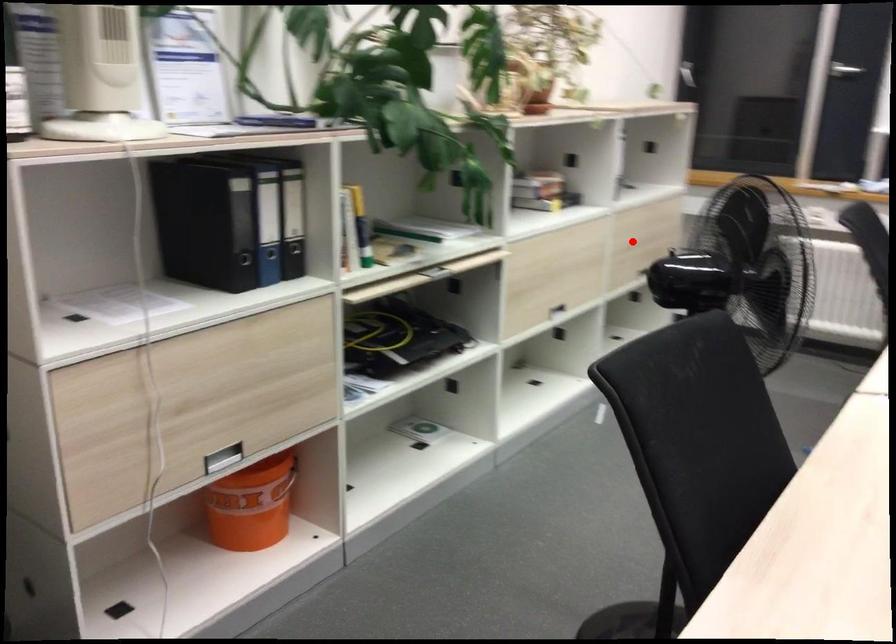
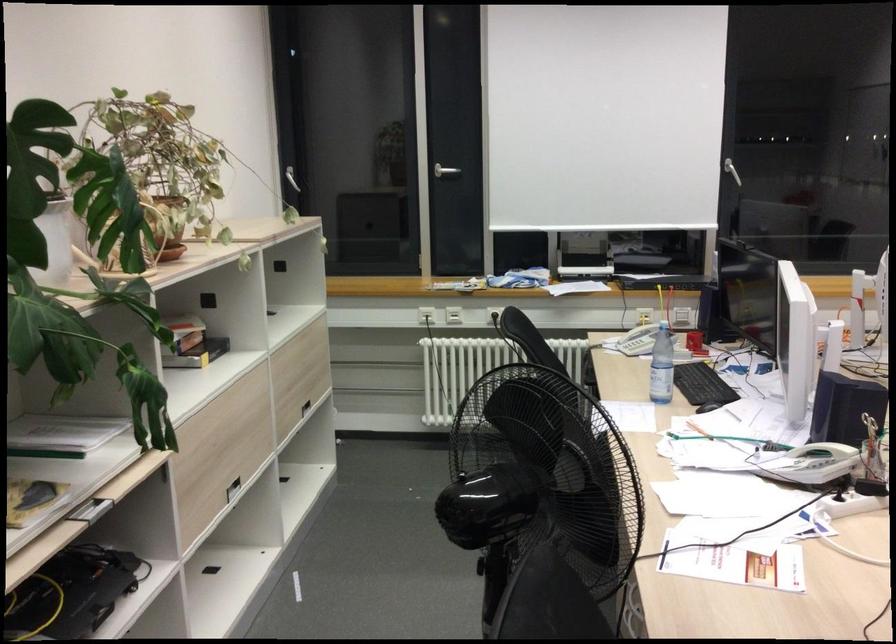
In the second image, find the point that corresponds to the highlighted location in the first image.

(298, 375)